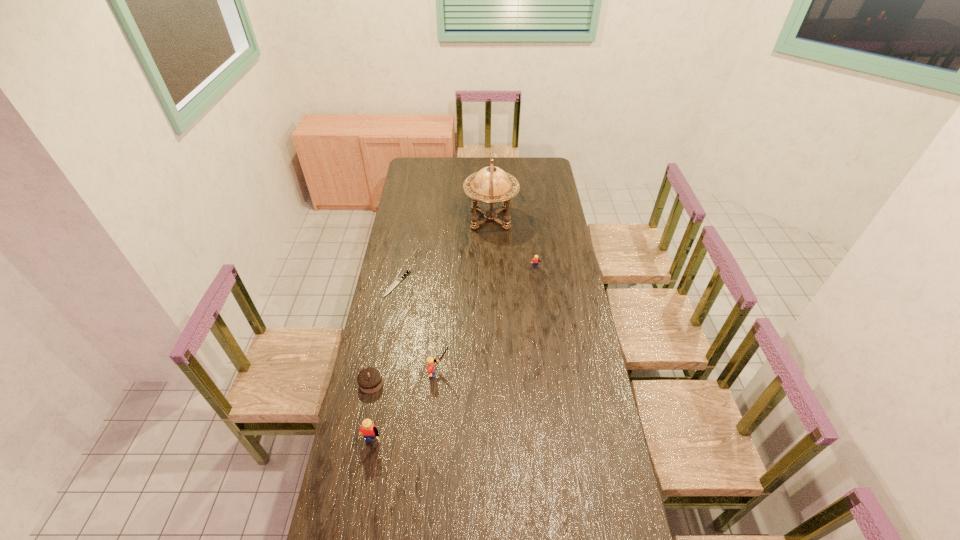
This screenshot has height=540, width=960. Find the location of `vacant space located 0.160m on the front-facing side of the nearest object`. vacant space located 0.160m on the front-facing side of the nearest object is located at coordinates (360, 514).

Where is `free space located 0.280m on the front-facing side of the second Lego from right to left`? The image size is (960, 540). free space located 0.280m on the front-facing side of the second Lego from right to left is located at coordinates (521, 374).

At what (x,y) coordinates should I click in order to perform the action: click on vacant position located 0.310m on the front-facing side of the rightmost object. Please return your answer as a coordinate pair (x, y). Looking at the image, I should click on (542, 323).

Where is `vacant space situated 0.240m on the front-facing side of the farthest object`? This screenshot has height=540, width=960. vacant space situated 0.240m on the front-facing side of the farthest object is located at coordinates (420, 219).

Where is `vacant space situated on the front-facing side of the farthest object`? vacant space situated on the front-facing side of the farthest object is located at coordinates pos(420,219).

Find the location of a particular element. The height and width of the screenshot is (540, 960). vacant space located on the front-facing side of the farthest object is located at coordinates (431, 219).

Find the location of `free space located on the front of the fifth tallest object`. free space located on the front of the fifth tallest object is located at coordinates (360, 442).

The width and height of the screenshot is (960, 540). What are the coordinates of `vacant space located 0.150m on the back of the steak knife` in the screenshot? It's located at (403, 251).

Identify the location of Lego that is at the left edge. (368, 429).

Find the location of a particular element. This screenshot has width=960, height=540. chocolate cake located at the left edge is located at coordinates (370, 380).